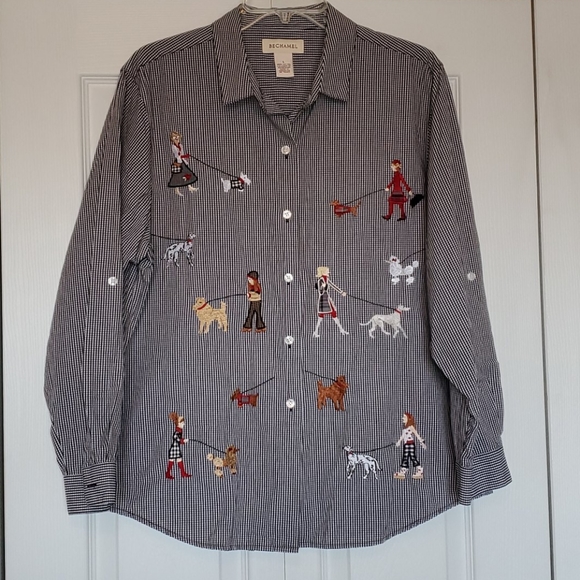
You are a GUI agent. You are given a task and a screenshot of the screen. Output one action in this format:
    pyautogui.click(x=<x>, y=<y>)
    Task: Click on the artwork lowest left
    The image size is (580, 580).
    Given the screenshot: What is the action you would take?
    pyautogui.click(x=187, y=444)